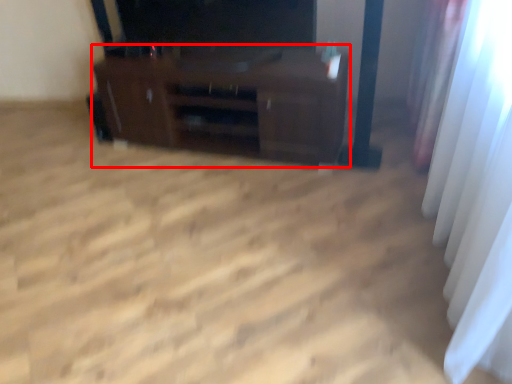
Question: Considering the relative positions of furniture (annotated by the red box) and curtain in the image provided, where is furniture (annotated by the red box) located with respect to the staircase?

Choices:
 (A) right
 (B) left

Answer: (B)